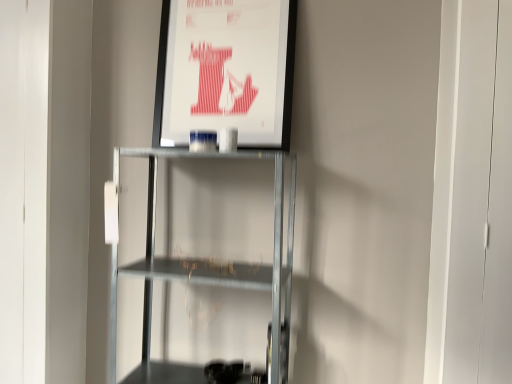
Image resolution: width=512 pixels, height=384 pixels. Identify the location of vacant space underneath matte paper poster at upper center (from a real-world perspective). (215, 154).